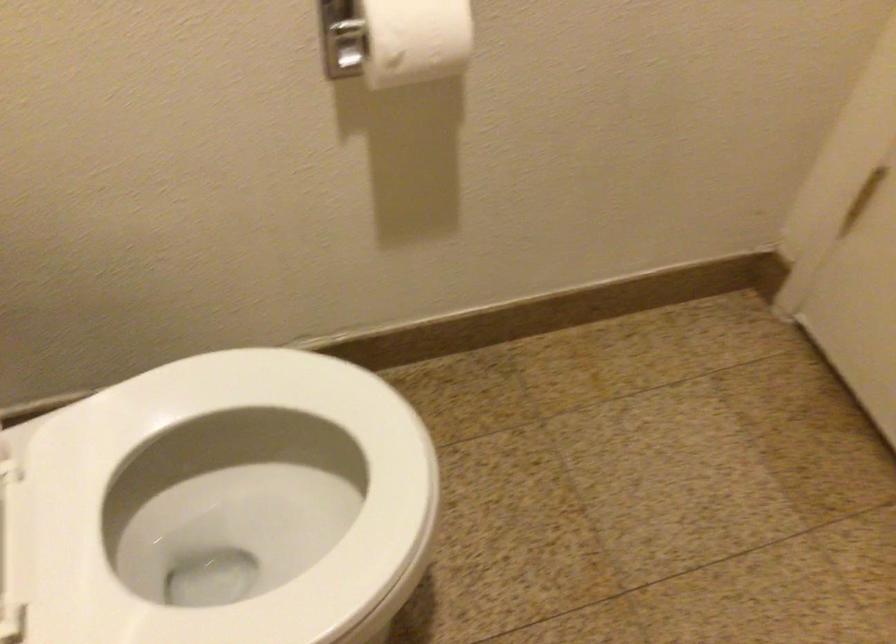
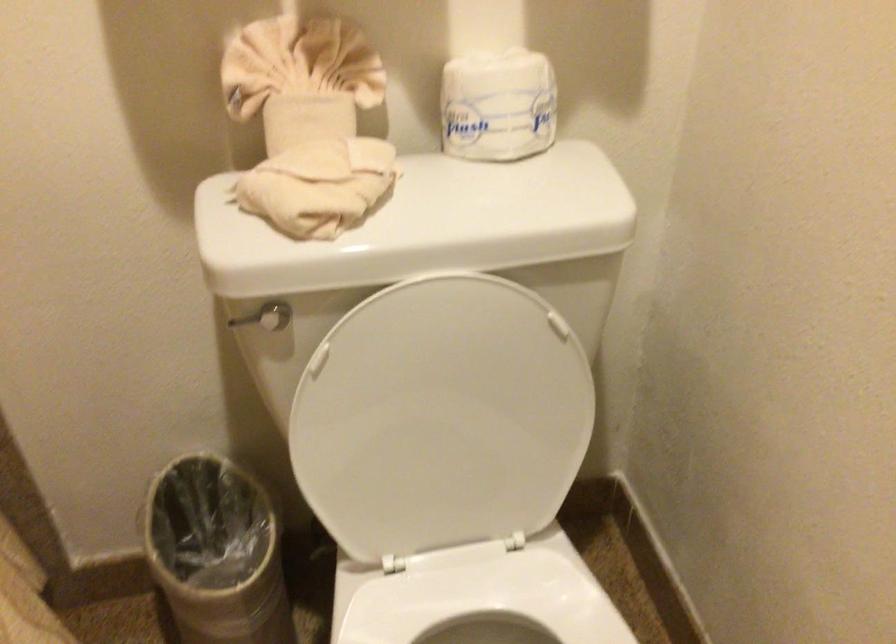
The first image is from the beginning of the video and the second image is from the end. How did the camera likely rotate when shooting the video?

The rotation direction of the camera is left-down.